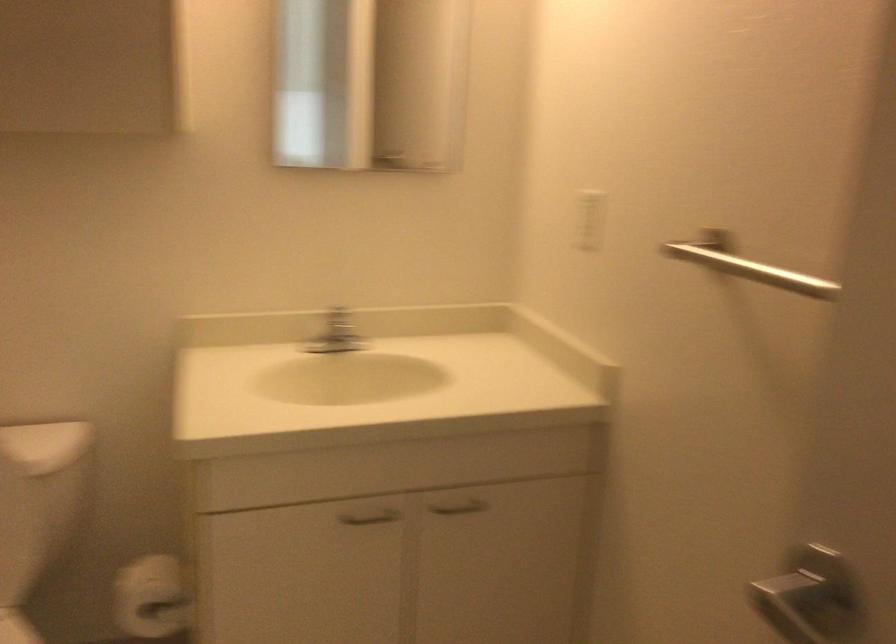
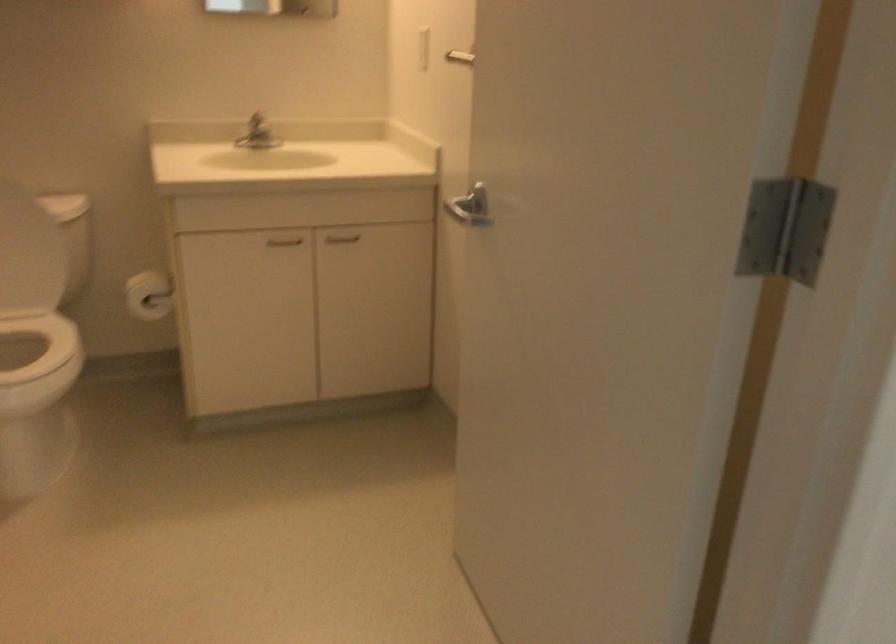
In the second image, find the point that corresponds to [334,346] in the first image.

(255, 133)